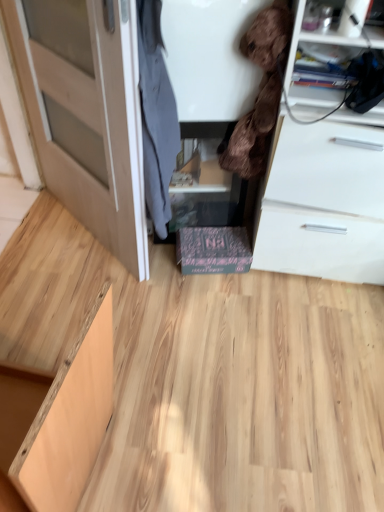
The width and height of the screenshot is (384, 512). Find the location of `vacant region below dark gray fabric coat at center, positioned as the 1th clothing in left-to-right order (from a real-world perspective)`. vacant region below dark gray fabric coat at center, positioned as the 1th clothing in left-to-right order (from a real-world perspective) is located at coordinates (164, 268).